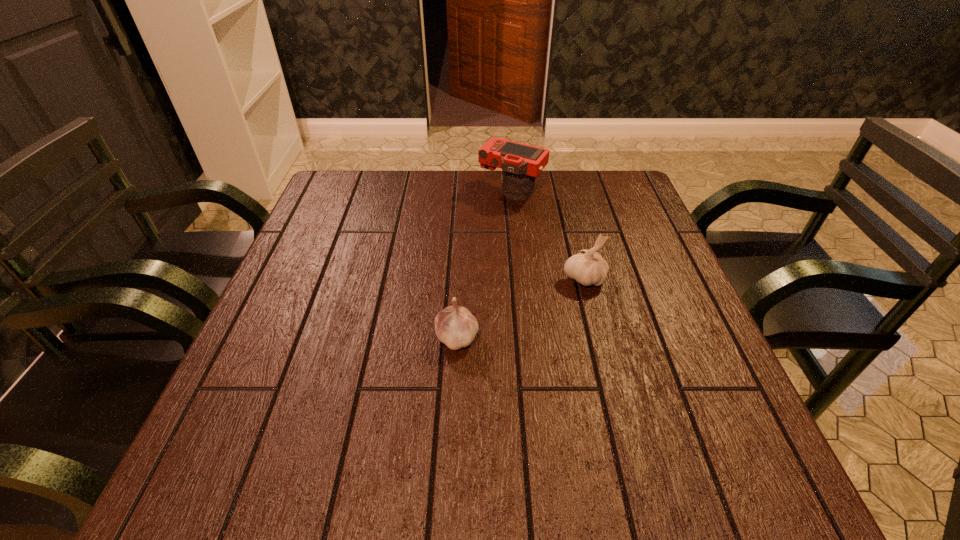
In order to click on free spot that satisfies the following two spatial constraints: 1. on the back side of the nearer garlic; 2. on the right side of the farthest object in this screenshot , I will do `click(464, 191)`.

The width and height of the screenshot is (960, 540). I want to click on free spot that satisfies the following two spatial constraints: 1. on the back side of the nearer garlic; 2. on the left side of the right garlic, so click(x=460, y=279).